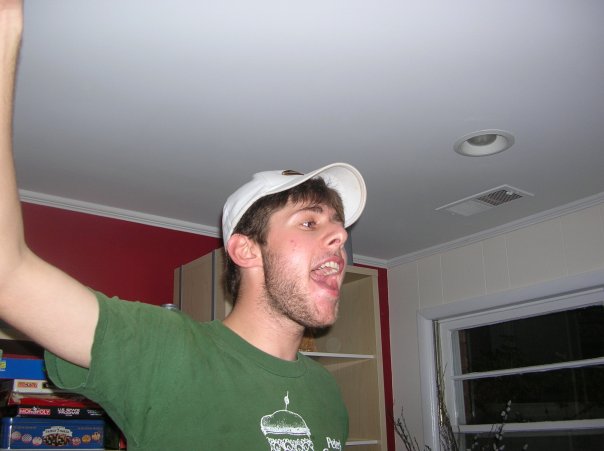
Where is `vent`? Image resolution: width=604 pixels, height=451 pixels. vent is located at coordinates (482, 197).